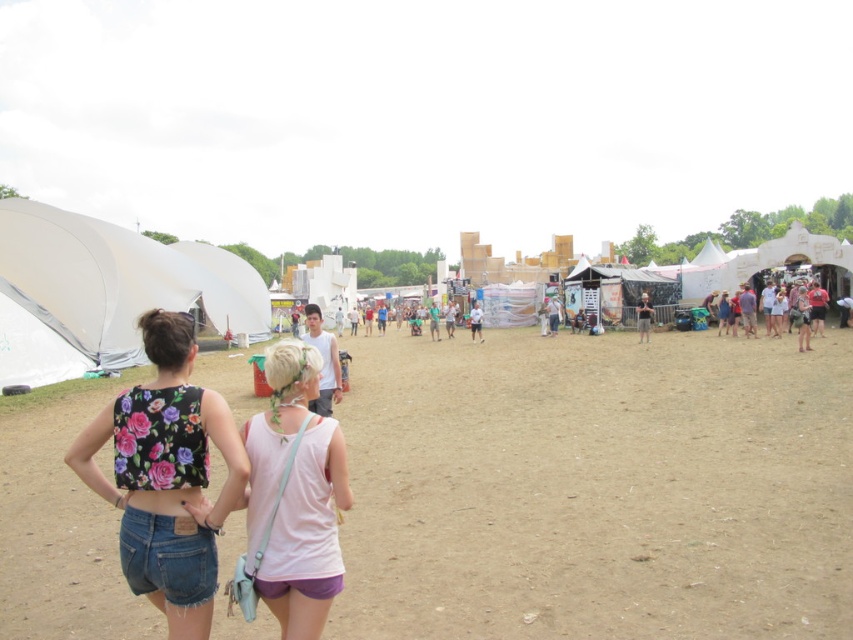
Does white matte tent at left come behind pink fabric tank top at center?

Yes.

Who is positioned more to the left, white matte tent at left or pink fabric tank top at center?

white matte tent at left is more to the left.

Is point (111, 237) positioned before point (253, 419)?

That is False.

This screenshot has width=853, height=640. In order to click on white matte tent at left in this screenshot , I will do `click(120, 278)`.

Does point (520, 616) come behind point (312, 508)?

Yes, it is behind point (312, 508).

Consider the image. Does brown sandy dirt field at center have a lesser height compared to pink fabric tank top at center?

No.

Describe the element at coordinates (596, 486) in the screenshot. This screenshot has width=853, height=640. I see `brown sandy dirt field at center` at that location.

Where is `brown sandy dirt field at center`? This screenshot has height=640, width=853. brown sandy dirt field at center is located at coordinates (596, 486).

Between floral fabric crop top at lower left and white matte tent at left, which one appears on the left side from the viewer's perspective?

white matte tent at left

Looking at this image, is floral fabric crop top at lower left bigger than white matte tent at left?

No, floral fabric crop top at lower left is not bigger than white matte tent at left.

Find the location of a particular element. This screenshot has width=853, height=640. floral fabric crop top at lower left is located at coordinates (166, 476).

At what (x,y) coordinates should I click in order to perform the action: click on floral fabric crop top at lower left. Please return your answer as a coordinate pair (x, y). The image size is (853, 640). Looking at the image, I should click on (166, 476).